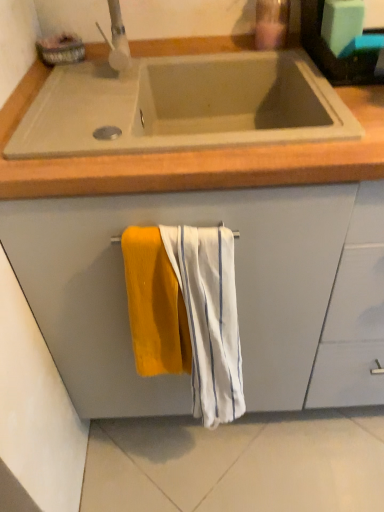
This screenshot has width=384, height=512. In order to click on vacant area in front of translucent plastic soap dispenser at upper center in this screenshot , I will do `click(289, 59)`.